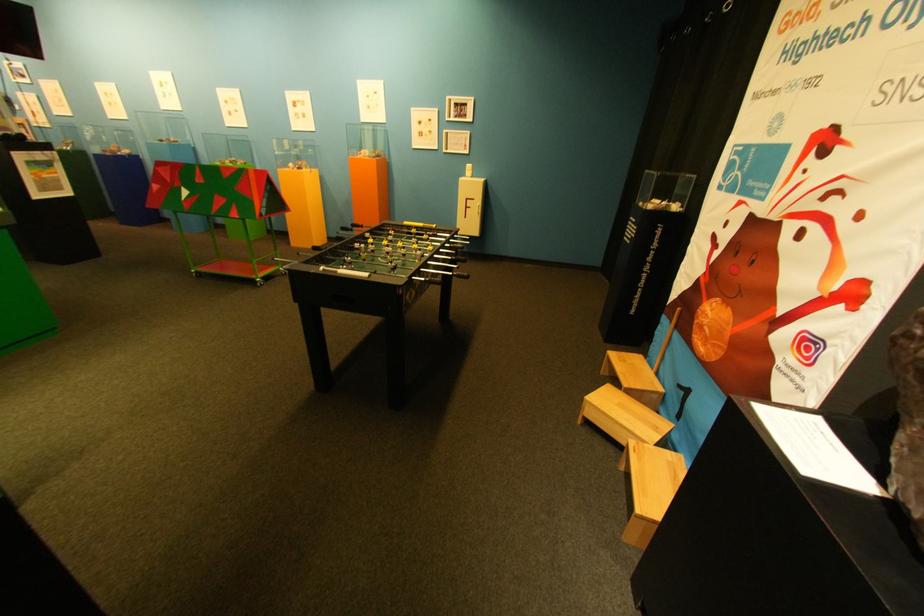
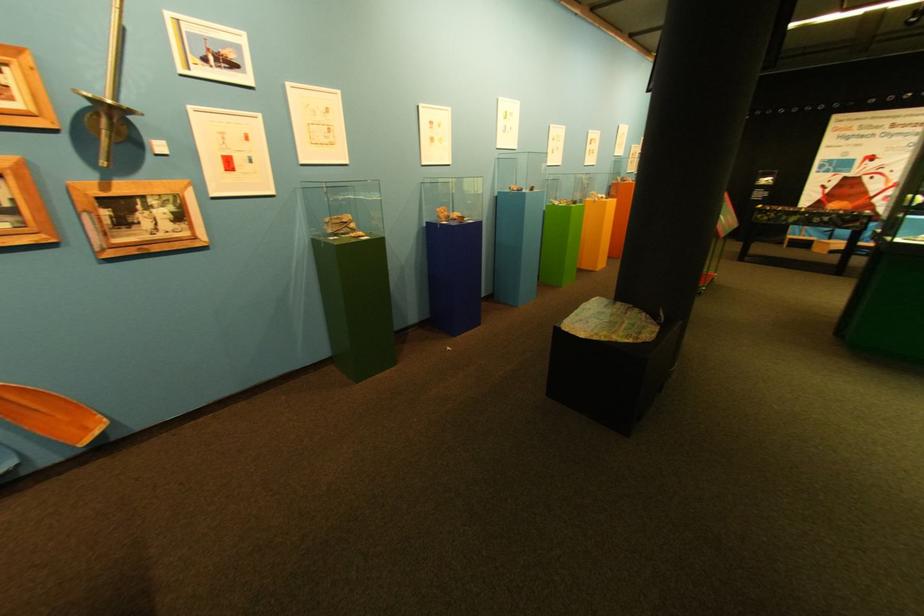
Locate, in the second image, the point that corresponds to (41,78) in the first image.

(248, 67)